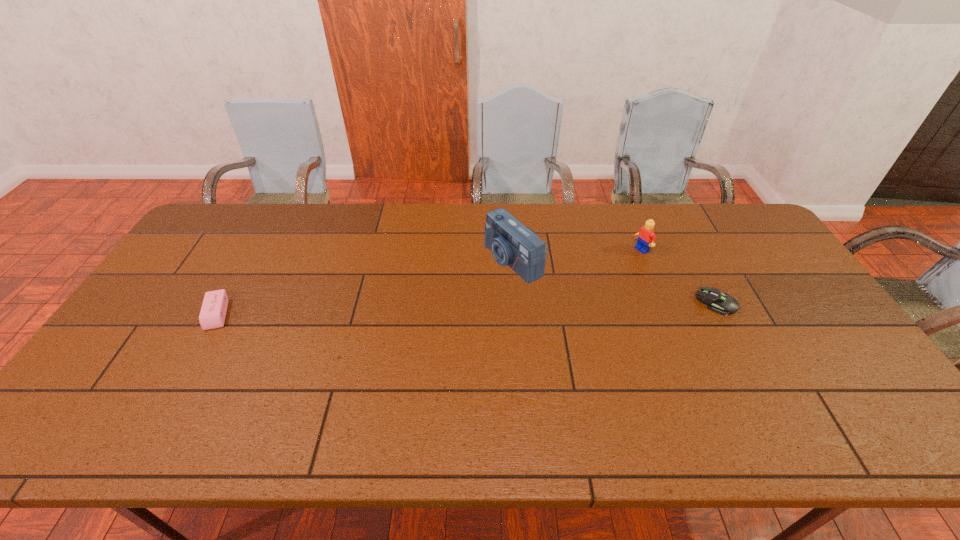
The image size is (960, 540). In order to click on eraser in this screenshot , I will do `click(214, 307)`.

Locate an element on the screen. The width and height of the screenshot is (960, 540). the third tallest object is located at coordinates (214, 307).

Locate an element on the screen. The width and height of the screenshot is (960, 540). the shortest object is located at coordinates (723, 304).

Find the location of a particular element. The height and width of the screenshot is (540, 960). the rightmost object is located at coordinates (723, 304).

At what (x,y) coordinates should I click in order to perform the action: click on camera. Please return your answer as a coordinate pair (x, y). Looking at the image, I should click on (511, 243).

Find the location of `the third shortest object`. the third shortest object is located at coordinates (646, 235).

Locate an element on the screen. The image size is (960, 540). Lego is located at coordinates (646, 235).

I want to click on free space located 0.190m on the front of the third tallest object, so click(172, 393).

Image resolution: width=960 pixels, height=540 pixels. Find the location of `vacant space situated 0.140m on the right of the rightmost object`. vacant space situated 0.140m on the right of the rightmost object is located at coordinates (783, 303).

Find the location of a particular element. The height and width of the screenshot is (540, 960). free point located on the lens of the third object from right to left is located at coordinates [x=442, y=295].